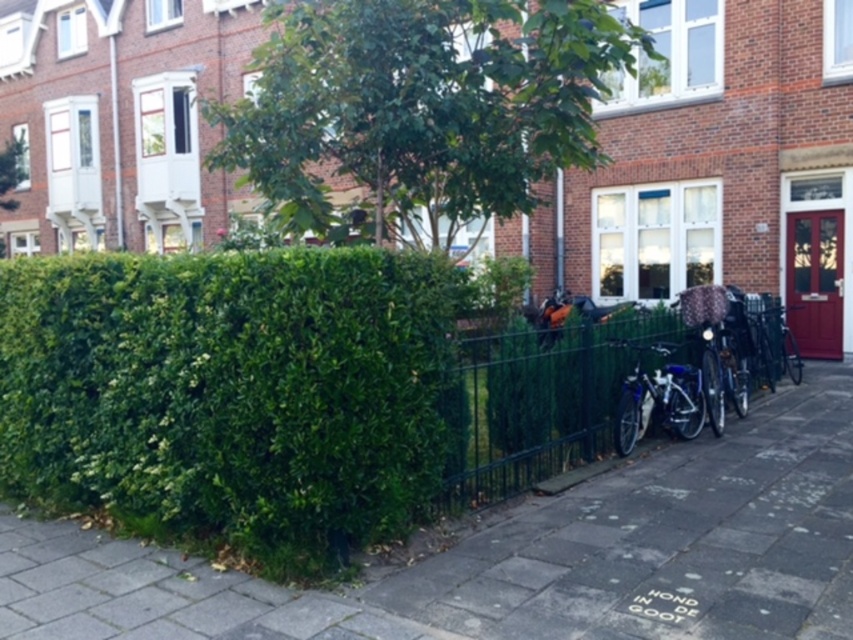
You are standing at the point marked as point (229, 394), which is the green leafy hedge at center. You want to walk to the black metal fence that is along the sidewalk edge. Which direction should you go to reach the fence?

The green leafy hedge at center is located at point (229, 394). To reach the black metal fence along the sidewalk edge, you should move towards the direction of the fence, which is positioned between the hedge and the sidewalk. Since the hedge is in the foreground and the fence is along the sidewalk edge, moving forward or towards the sidewalk from the hedge would lead you to the fence.

You are standing on the sidewalk in front of the brick building. You see the green leafy hedge at center and the green leafy tree at center. Which one is closer to you?

The green leafy hedge at center is closer to the viewer than the green leafy tree at center.

You are standing on the sidewalk in front of the black metal fence. You want to place a new bench that is 2 meters long between the shiny blue bicycle at center and the green leafy tree at upper left. Is there enough space?

The distance between the shiny blue bicycle at center and the green leafy tree at upper left is 26.55 meters. Since the bench is only 2 meters long, there is more than enough space to place it between them.